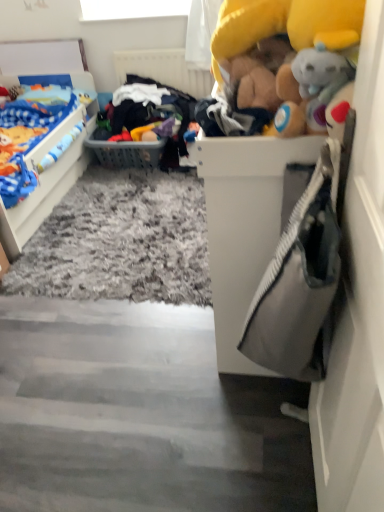
Question: From a real-world perspective, is shaggy carpet at lower center above or below white textured radiator at upper center?

Choices:
 (A) below
 (B) above

Answer: (A)

Question: Considering their positions, is shaggy carpet at lower center located in front of or behind white textured radiator at upper center?

Choices:
 (A) front
 (B) behind

Answer: (A)

Question: Which object is the closest to the white matte door at right?

Choices:
 (A) matte blue blanket at left, positioned as the 1th toy in back-to-front order
 (B) yellow plush toy at upper right, the 1th toy positioned from the right
 (C) white textured radiator at upper center
 (D) gray plastic basket at center
 (E) shaggy carpet at lower center

Answer: (B)

Question: Which object is positioned closest to the shaggy carpet at lower center?

Choices:
 (A) white textured radiator at upper center
 (B) matte blue blanket at left, which is counted as the second toy, starting from the front
 (C) gray plastic basket at center
 (D) white matte door at right
 (E) yellow plush toy at upper right, which appears as the second toy when viewed from the left

Answer: (D)